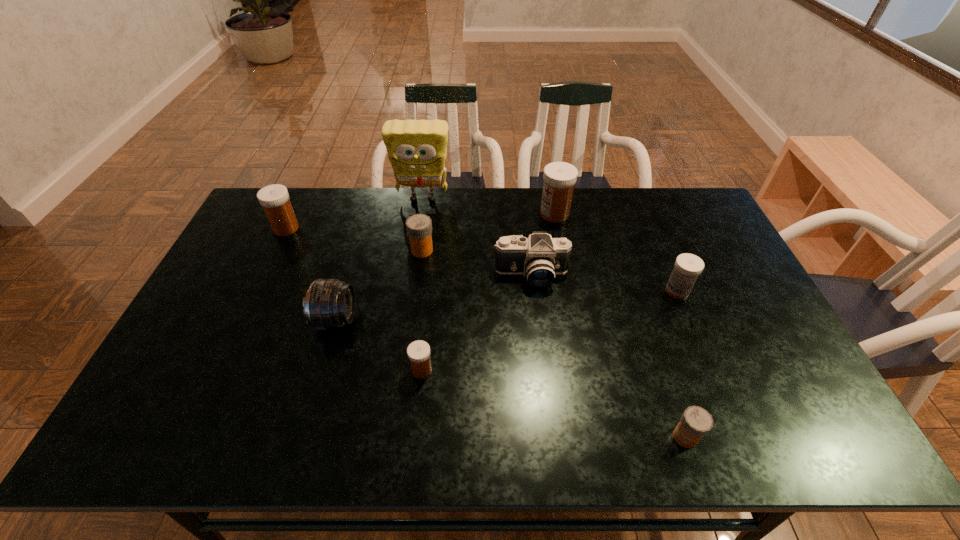
Find the location of `vacant area between the leftmost medicine and the right orange medicine`. vacant area between the leftmost medicine and the right orange medicine is located at coordinates (486, 333).

Find the location of `vacant area that lies between the camera and the tallest object`. vacant area that lies between the camera and the tallest object is located at coordinates (477, 237).

Locate an element on the screen. vacant region between the leftmost medicine and the nearer orange medicine is located at coordinates click(x=486, y=333).

Locate an element on the screen. The image size is (960, 540). vacant space in between the telephoto lens and the sponge is located at coordinates (379, 259).

You are a GUI agent. You are given a task and a screenshot of the screen. Output one action in this format:
    pyautogui.click(x=<x>, y=<y>)
    Task: Click on the object that can be found as the fifth closest to the rightmost white medicine
    
    Given the screenshot: What is the action you would take?
    pyautogui.click(x=419, y=226)

Where is `object that stands as the fifth closest to the second white medicine from right to left`? The width and height of the screenshot is (960, 540). object that stands as the fifth closest to the second white medicine from right to left is located at coordinates (418, 352).

You are a GUI agent. You are given a task and a screenshot of the screen. Output one action in this format:
    pyautogui.click(x=<x>, y=<y>)
    Task: Click on the fourth closest medicine relative to the sixth nearest object
    The height and width of the screenshot is (540, 960).
    Given the screenshot: What is the action you would take?
    pyautogui.click(x=687, y=267)

Identify which medicine is located as the nearest to the leftmost object. Please provide its 2D coordinates. Your answer should be formatted as a tuple, i.e. [(x, y)], where the tuple contains the x and y coordinates of a point satisfying the conditions above.

[(419, 226)]

Identify which white medicine is the third nearest to the eighth object from left to right. Please provide its 2D coordinates. Your answer should be formatted as a tuple, i.e. [(x, y)], where the tuple contains the x and y coordinates of a point satisfying the conditions above.

[(559, 178)]

Locate an element on the screen. The height and width of the screenshot is (540, 960). white medicine that is the nearest to the telephoto lens is located at coordinates (418, 352).